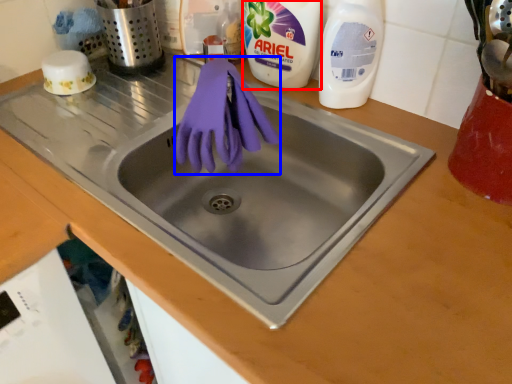
Question: Which object appears farthest to the camera in this image, cleaning product (highlighted by a red box) or glove (highlighted by a blue box)?

Choices:
 (A) cleaning product
 (B) glove

Answer: (A)